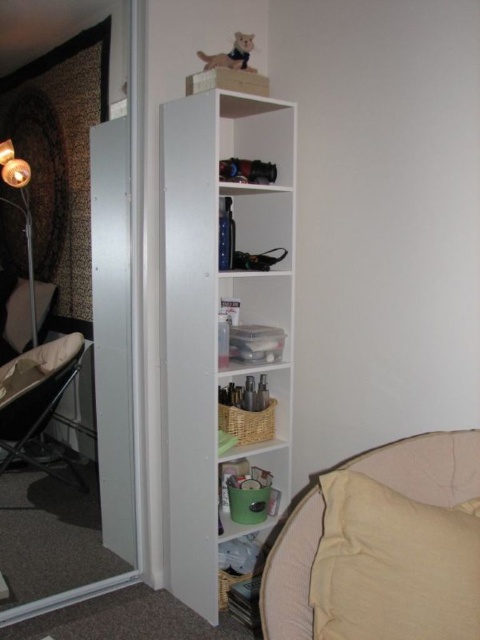
Which is below, beige fabric pillow at lower right or matte gold lamp at left?

Positioned lower is beige fabric pillow at lower right.

Which of these two, beige fabric pillow at lower right or matte gold lamp at left, stands taller?

matte gold lamp at left

Where is `beige fabric pillow at lower right`? The image size is (480, 640). beige fabric pillow at lower right is located at coordinates (394, 564).

What are the coordinates of `beige fabric pillow at lower right` in the screenshot? It's located at (394, 564).

Can you confirm if white matte bookshelf at center is positioned below beige fabric pillow at lower right?

Actually, white matte bookshelf at center is above beige fabric pillow at lower right.

Who is lower down, white matte bookshelf at center or beige fabric pillow at lower right?

Positioned lower is beige fabric pillow at lower right.

Does point (290, 118) come behind point (345, 582)?

Yes, it is behind point (345, 582).

You are a GUI agent. You are given a task and a screenshot of the screen. Output one action in this format:
    pyautogui.click(x=<x>, y=<y>)
    Task: Click on the white matte bookshelf at center
    The width and height of the screenshot is (480, 640).
    Given the screenshot: What is the action you would take?
    pyautogui.click(x=216, y=314)

Describe the element at coordinates (394, 564) in the screenshot. I see `beige fabric pillow at lower right` at that location.

Which is above, beige fabric pillow at lower right or metallic silver folding chair at left?

metallic silver folding chair at left

You are a GUI agent. You are given a task and a screenshot of the screen. Output one action in this format:
    pyautogui.click(x=<x>, y=<y>)
    Task: Click on the beige fabric pillow at lower right
    The height and width of the screenshot is (640, 480).
    Given the screenshot: What is the action you would take?
    pyautogui.click(x=394, y=564)